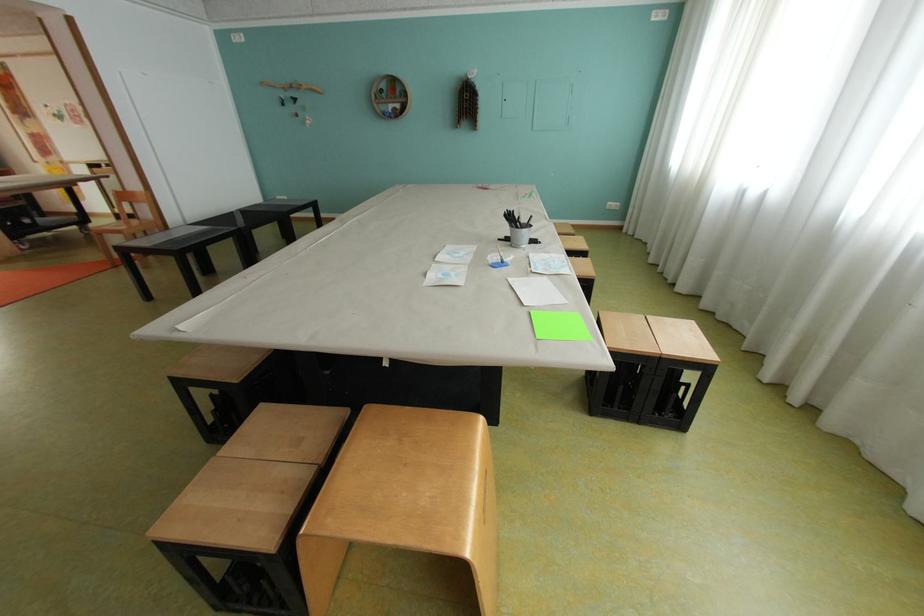
The location [517,228] corresponds to which object?

It refers to a white pencil holder.